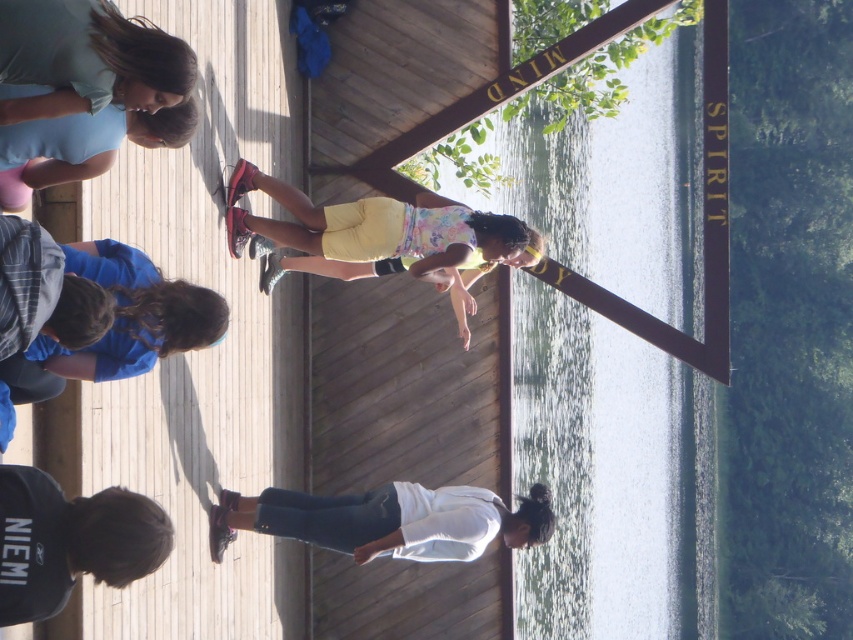
You are a photographer trying to capture a photo of the yellow cotton shorts at center and the black cotton hoodie at lower left. Based on their positions, which object should you focus on first to ensure both are in the frame?

The yellow cotton shorts at center is located above the black cotton hoodie at lower left, so you should focus on the black cotton hoodie at lower left first to ensure both are in the frame.

You are a photographer trying to capture a group shot of the children in the scene. You notice the white matte shirt at lower center and the matte blue shirt at upper left. Which child should you focus on to ensure their entire shirt is visible in the frame, considering their shirt sizes?

The white matte shirt at lower center has a larger width than the matte blue shirt at upper left, so focusing on the child wearing the white matte shirt at lower center would ensure their entire shirt is visible in the frame.

Based on the scene description, which object is bigger between the yellow cotton shorts at center and the matte blue shirt at upper left?

The yellow cotton shorts at center is larger in size compared to the matte blue shirt at upper left according to the description.